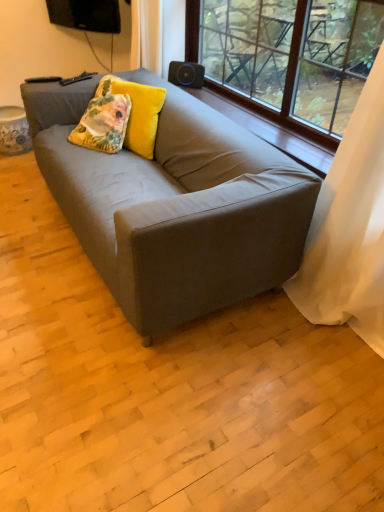
Question: Is white sheer curtain at right far away from floral-patterned velvet pillow at upper left?

Choices:
 (A) no
 (B) yes

Answer: (B)

Question: Considering the relative positions of white sheer curtain at right and floral-patterned velvet pillow at upper left in the image provided, is white sheer curtain at right in front of floral-patterned velvet pillow at upper left?

Choices:
 (A) yes
 (B) no

Answer: (A)

Question: Would you say floral-patterned velvet pillow at upper left is part of white sheer curtain at right's contents?

Choices:
 (A) no
 (B) yes

Answer: (A)

Question: From a real-world perspective, is white sheer curtain at right on top of floral-patterned velvet pillow at upper left?

Choices:
 (A) no
 (B) yes

Answer: (B)

Question: From the image's perspective, would you say white sheer curtain at right is shown under floral-patterned velvet pillow at upper left?

Choices:
 (A) no
 (B) yes

Answer: (B)

Question: Looking at their shapes, would you say transparent glass window at upper center is wider or thinner than floral-patterned velvet pillow at upper left?

Choices:
 (A) wide
 (B) thin

Answer: (B)

Question: In the image, is transparent glass window at upper center positioned in front of or behind floral-patterned velvet pillow at upper left?

Choices:
 (A) front
 (B) behind

Answer: (A)

Question: Considering the positions of point (284, 87) and point (92, 138), is point (284, 87) closer or farther from the camera than point (92, 138)?

Choices:
 (A) farther
 (B) closer

Answer: (B)

Question: Looking at the image, does transparent glass window at upper center seem bigger or smaller compared to floral-patterned velvet pillow at upper left?

Choices:
 (A) small
 (B) big

Answer: (B)

Question: From a real-world perspective, is floral-patterned velvet pillow at upper left above or below floral-patterned velvet pillow at center?

Choices:
 (A) above
 (B) below

Answer: (B)

Question: In the image, is floral-patterned velvet pillow at upper left positioned in front of or behind floral-patterned velvet pillow at center?

Choices:
 (A) front
 (B) behind

Answer: (B)

Question: From the image's perspective, relative to floral-patterned velvet pillow at center, is floral-patterned velvet pillow at upper left above or below?

Choices:
 (A) above
 (B) below

Answer: (B)

Question: Is floral-patterned velvet pillow at upper left spatially inside floral-patterned velvet pillow at center, or outside of it?

Choices:
 (A) outside
 (B) inside

Answer: (B)

Question: From the image's perspective, is floral-patterned velvet pillow at center above or below matte gray couch at center?

Choices:
 (A) below
 (B) above

Answer: (B)

Question: Which is correct: floral-patterned velvet pillow at center is inside matte gray couch at center, or outside of it?

Choices:
 (A) outside
 (B) inside

Answer: (B)